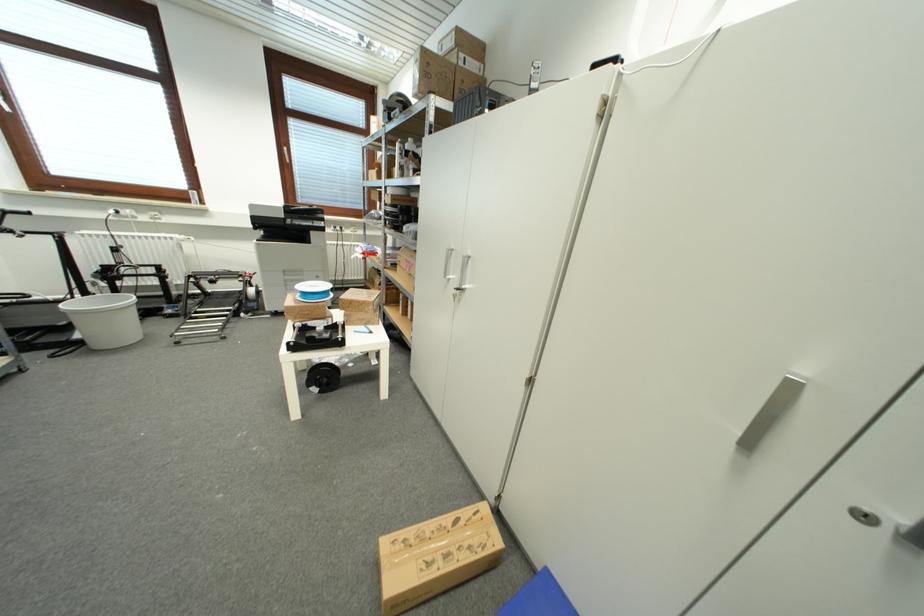
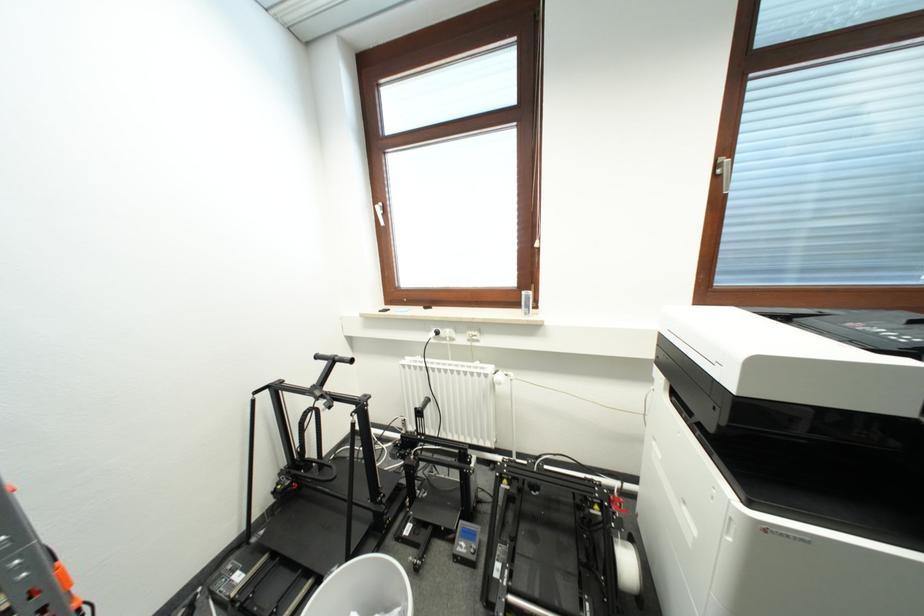
The point at (178, 238) is marked in the first image. Where is the corresponding point in the second image?

(494, 371)